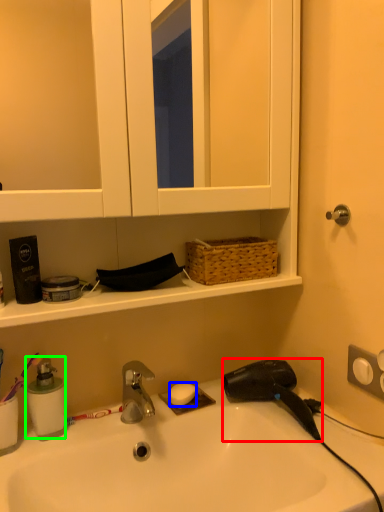
Question: Which is nearer to the hair drier (highlighted by a red box)? soap (highlighted by a blue box) or soap dispenser (highlighted by a green box).

Choices:
 (A) soap
 (B) soap dispenser

Answer: (A)